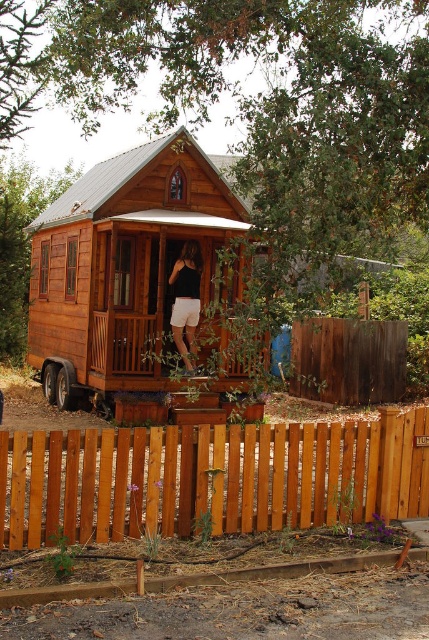
Question: Is wooden picket fence at center thinner than wooden porch at center?

Choices:
 (A) yes
 (B) no

Answer: (B)

Question: Does wooden picket fence at center appear under black rubber wheel at lower left?

Choices:
 (A) yes
 (B) no

Answer: (A)

Question: Among these points, which one is nearest to the camera?

Choices:
 (A) (145, 209)
 (B) (223, 387)
 (C) (53, 387)
 (D) (399, 420)

Answer: (D)

Question: Is wooden cabin at center to the left of metallic silver wheel at lower left from the viewer's perspective?

Choices:
 (A) yes
 (B) no

Answer: (B)

Question: Which of the following is the closest to the observer?

Choices:
 (A) (160, 150)
 (B) (192, 348)
 (C) (50, 380)
 (D) (63, 388)

Answer: (B)

Question: Which point is closer to the camera?

Choices:
 (A) (157, 472)
 (B) (157, 323)
 (C) (166, 204)

Answer: (A)